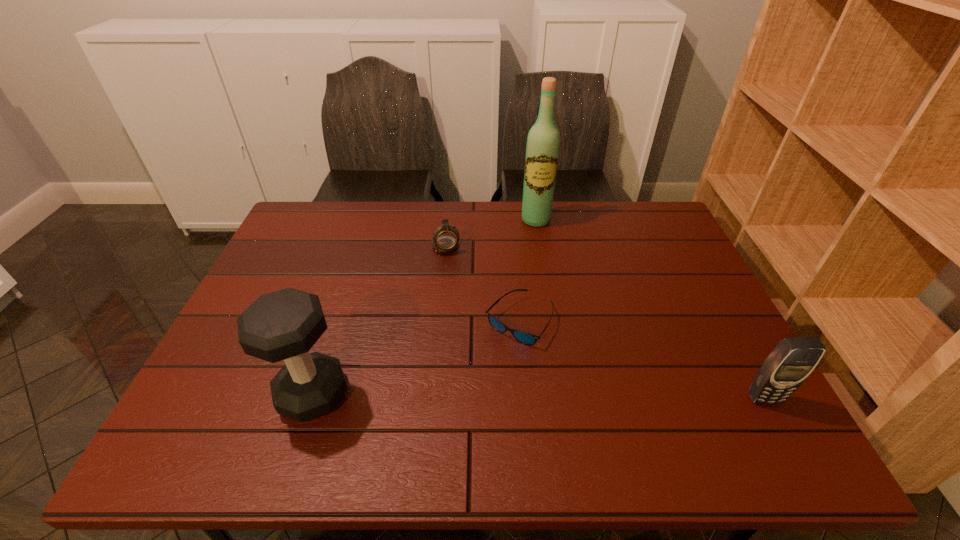
In order to click on dumbbell in this screenshot , I will do `click(283, 325)`.

At what (x,y) coordinates should I click in order to perform the action: click on the leftmost object. Please return your answer as a coordinate pair (x, y). The image size is (960, 540). Looking at the image, I should click on (283, 325).

Where is `cellular telephone`? The width and height of the screenshot is (960, 540). cellular telephone is located at coordinates (784, 370).

Identify the location of the rightmost object. (784, 370).

Where is `the fourth nearest object`? the fourth nearest object is located at coordinates (445, 238).

At what (x,y) coordinates should I click in order to perform the action: click on the second shortest object. Please return your answer as a coordinate pair (x, y). The height and width of the screenshot is (540, 960). Looking at the image, I should click on (445, 238).

Find the location of a particular element. the shortest object is located at coordinates (526, 338).

Identify the location of sunglasses. The width and height of the screenshot is (960, 540). (526, 338).

Identify the location of wine bottle. The width and height of the screenshot is (960, 540). (543, 142).

Where is `the tallest object`? This screenshot has width=960, height=540. the tallest object is located at coordinates (543, 142).